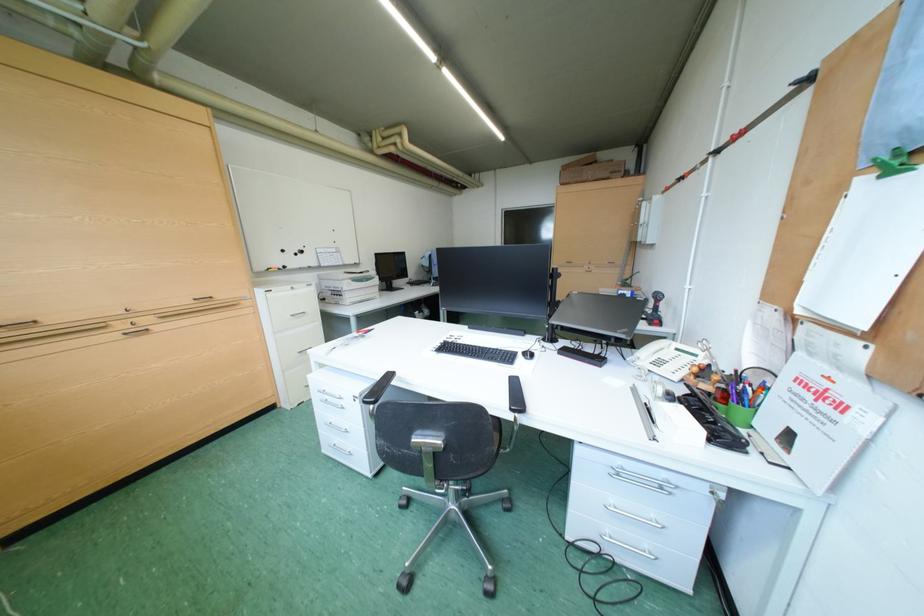
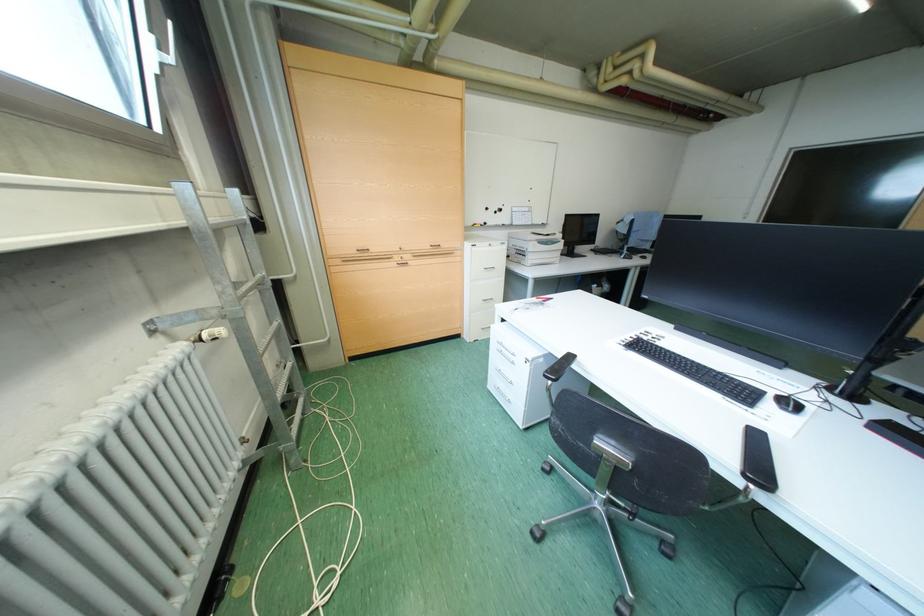
Question: The camera is either moving clockwise (left) or counter-clockwise (right) around the object. The first image is from the beginning of the video and the second image is from the end. Is the camera moving left or right when shooting the video?

Choices:
 (A) Left
 (B) Right

Answer: (B)